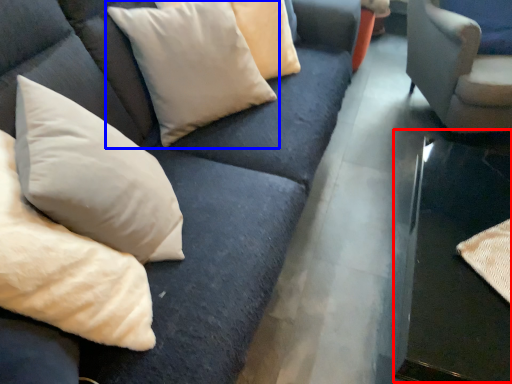
Question: Which point is closer to the camera, table (highlighted by a red box) or pillow (highlighted by a blue box)?

Choices:
 (A) table
 (B) pillow

Answer: (A)